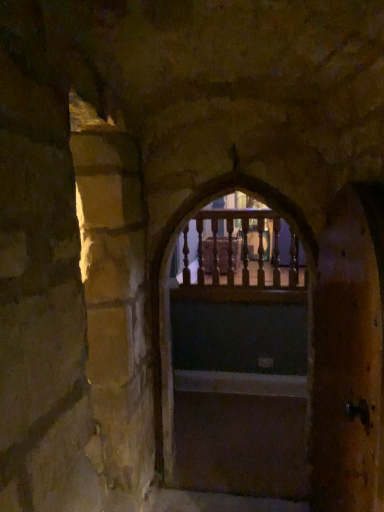
Find the location of a particular element. This screenshot has height=512, width=384. vacant region below wooden railing at center (from a real-world perspective) is located at coordinates (250, 482).